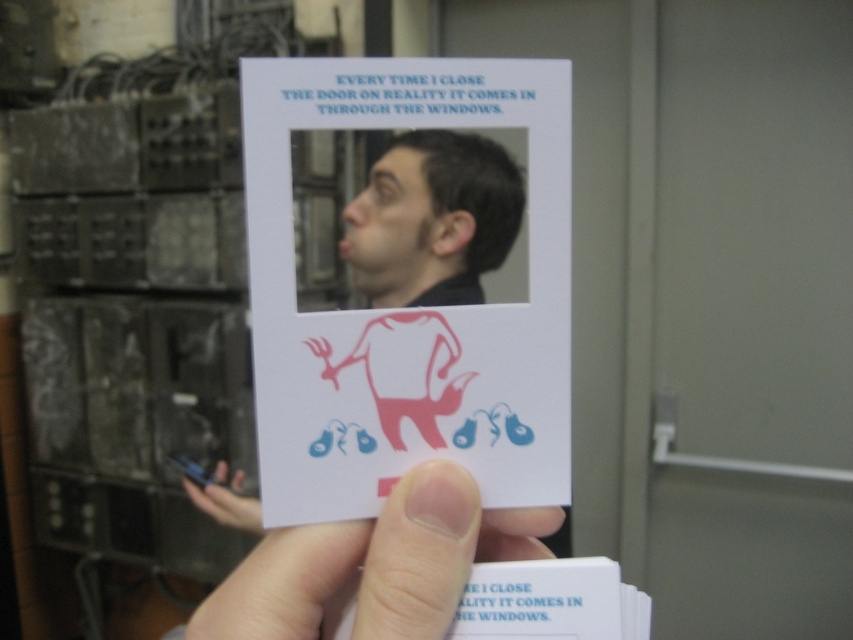
From the picture: Does white paper card at center lie behind flesh-toned skin at lower center?

Yes, white paper card at center is behind flesh-toned skin at lower center.

Between point (548, 449) and point (408, 573), which one is positioned behind?

The point (548, 449) is more distant.

The image size is (853, 640). I want to click on white paper card at center, so 407,308.

Does white paper card at center have a greater width compared to matte black hair at upper center?

Indeed, white paper card at center has a greater width compared to matte black hair at upper center.

Does white paper card at center have a larger size compared to matte black hair at upper center?

No, white paper card at center is not bigger than matte black hair at upper center.

Is point (564, 230) more distant than point (509, 202)?

That is False.

Where is `white paper card at center`? This screenshot has width=853, height=640. white paper card at center is located at coordinates (407, 308).

Which is below, flesh-toned skin at lower center or matte black hair at upper center?

flesh-toned skin at lower center is below.

Can you confirm if flesh-toned skin at lower center is positioned to the left of matte black hair at upper center?

Yes, flesh-toned skin at lower center is to the left of matte black hair at upper center.

The height and width of the screenshot is (640, 853). Describe the element at coordinates (375, 563) in the screenshot. I see `flesh-toned skin at lower center` at that location.

I want to click on flesh-toned skin at lower center, so click(x=375, y=563).